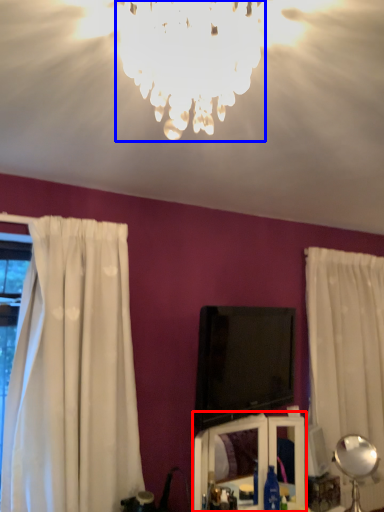
Question: Among these objects, which one is farthest to the camera, vanity (highlighted by a red box) or lamp (highlighted by a blue box)?

Choices:
 (A) vanity
 (B) lamp

Answer: (A)